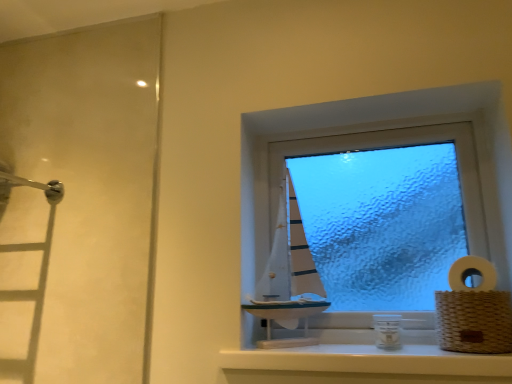
Question: Considering the positions of point tap(285, 347) and point tap(481, 284), is point tap(285, 347) closer or farther from the camera than point tap(481, 284)?

Choices:
 (A) farther
 (B) closer

Answer: (A)

Question: From the image's perspective, is white glossy window sill at center positioned above or below white woven basket at right?

Choices:
 (A) below
 (B) above

Answer: (A)

Question: Based on their relative distances, which object is farther from the woven brown basket at right?

Choices:
 (A) white woven basket at right
 (B) white glossy window sill at center
 (C) transparent frosted glass sailboat at center

Answer: (C)

Question: Which is farther from the transparent frosted glass sailboat at center?

Choices:
 (A) white woven basket at right
 (B) white glossy window sill at center
 (C) woven brown basket at right

Answer: (B)